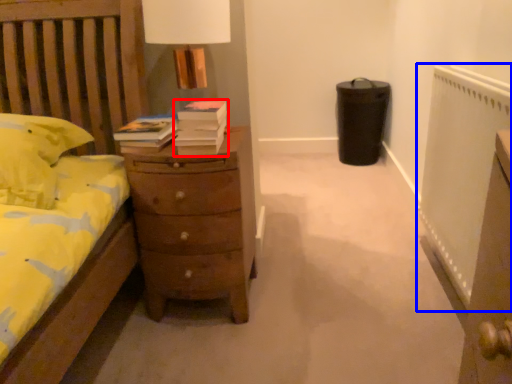
Question: Among these objects, which one is nearest to the camera, book (highlighted by a red box) or radiator (highlighted by a blue box)?

Choices:
 (A) book
 (B) radiator

Answer: (B)